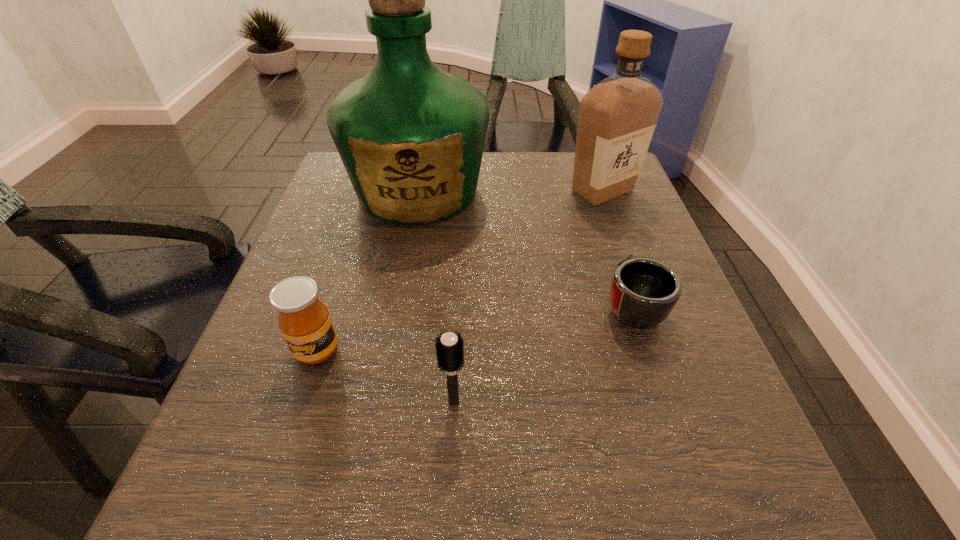
Identify the location of vacant area in the image that satisfies the following two spatial constraints: 1. on the label side of the taller liquor; 2. on the right side of the nearest object. (380, 402).